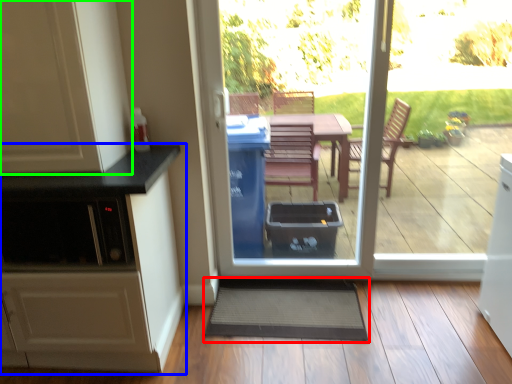
Question: Which object is the farthest from doormat (highlighted by a red box)? Choose among these: cabinetry (highlighted by a blue box) or cabinetry (highlighted by a green box).

Choices:
 (A) cabinetry
 (B) cabinetry

Answer: (B)